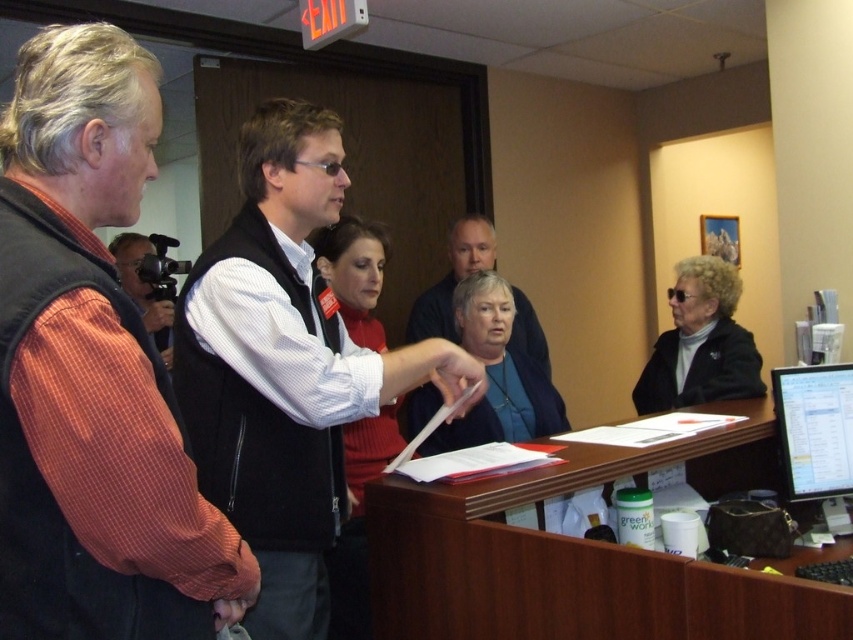
Does matte black vest at center have a greater height compared to orange striped shirt at left?

Yes, matte black vest at center is taller than orange striped shirt at left.

Which is above, matte black vest at center or orange striped shirt at left?

orange striped shirt at left is higher up.

Locate an element on the screen. matte black vest at center is located at coordinates (451, 278).

Identify the location of matte black vest at center. (451, 278).

Can you confirm if wooden desk at center is bigger than black glossy monitor at center right?

Yes.

This screenshot has height=640, width=853. What are the coordinates of `wooden desk at center` in the screenshot? It's located at (581, 556).

Does black glossy monitor at center right appear on the left side of matte black vest at center?

In fact, black glossy monitor at center right is to the right of matte black vest at center.

From the picture: Measure the distance from black glossy monitor at center right to matte black vest at center.

A distance of 3.79 feet exists between black glossy monitor at center right and matte black vest at center.

In order to click on black glossy monitor at center right in this screenshot , I will do `click(815, 428)`.